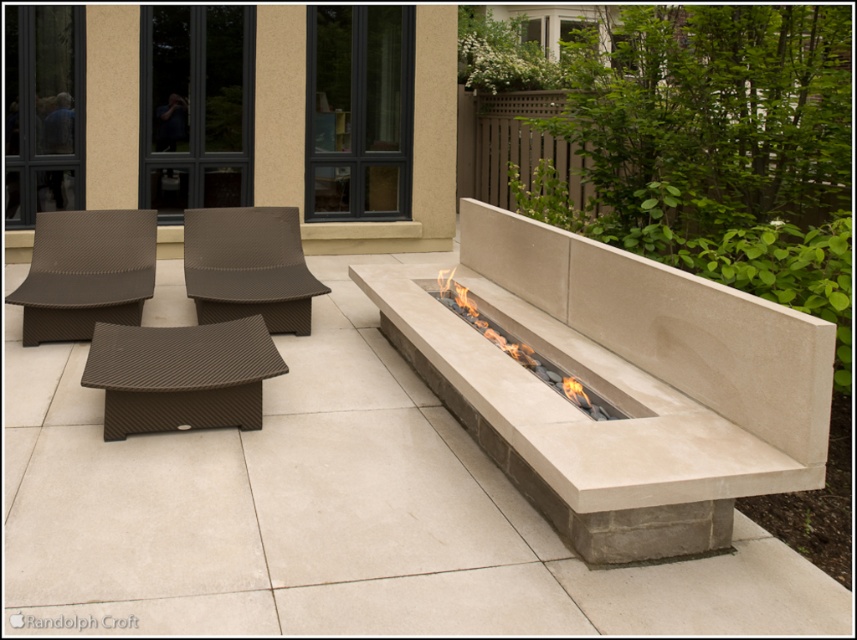
Can you confirm if beige concrete fire pit at center is positioned above brown woven chair at center?

Incorrect, beige concrete fire pit at center is not positioned above brown woven chair at center.

Does beige concrete fire pit at center have a smaller size compared to brown woven chair at center?

Actually, beige concrete fire pit at center might be larger than brown woven chair at center.

Who is more forward, (734, 340) or (193, 225)?

Point (734, 340) is more forward.

The image size is (857, 640). I want to click on beige concrete fire pit at center, so click(x=618, y=385).

Can you confirm if brown woven chair at left is positioned to the right of beige stone fire pit at center?

In fact, brown woven chair at left is to the left of beige stone fire pit at center.

Describe the element at coordinates (87, 273) in the screenshot. I see `brown woven chair at left` at that location.

Where is `brown woven chair at left`? brown woven chair at left is located at coordinates (87, 273).

Does beige concrete fire pit at center have a greater width compared to brown woven chair at left?

Yes.

Is beige concrete fire pit at center above brown woven chair at left?

Incorrect, beige concrete fire pit at center is not positioned above brown woven chair at left.

Image resolution: width=857 pixels, height=640 pixels. What do you see at coordinates (618, 385) in the screenshot?
I see `beige concrete fire pit at center` at bounding box center [618, 385].

Find the location of `beige concrete fire pit at center`. beige concrete fire pit at center is located at coordinates (618, 385).